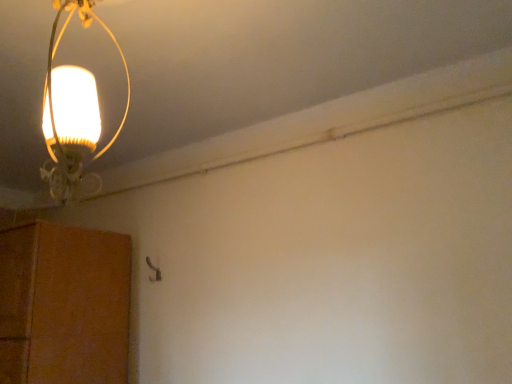
The height and width of the screenshot is (384, 512). I want to click on matte glass lamp at upper left, so click(72, 112).

Image resolution: width=512 pixels, height=384 pixels. Describe the element at coordinates (72, 112) in the screenshot. I see `matte glass lamp at upper left` at that location.

The height and width of the screenshot is (384, 512). What do you see at coordinates (66, 302) in the screenshot?
I see `brown textured cabinet at lower left` at bounding box center [66, 302].

I want to click on brown textured cabinet at lower left, so click(66, 302).

The width and height of the screenshot is (512, 384). What are the coordinates of `matte glass lamp at upper left` in the screenshot? It's located at (72, 112).

Is brown textured cabinet at lower left to the right of matte glass lamp at upper left from the viewer's perspective?

In fact, brown textured cabinet at lower left is to the left of matte glass lamp at upper left.

Is brown textured cabinet at lower left in front of matte glass lamp at upper left?

No, brown textured cabinet at lower left is behind matte glass lamp at upper left.

Which point is more distant from viewer, [4,295] or [84,145]?

The point [4,295] is farther.

From the image's perspective, is brown textured cabinet at lower left located above matte glass lamp at upper left?

Incorrect, from the image's perspective, brown textured cabinet at lower left is lower than matte glass lamp at upper left.

From a real-world perspective, is brown textured cabinet at lower left below matte glass lamp at upper left?

Yes, from a real-world perspective, brown textured cabinet at lower left is below matte glass lamp at upper left.

Does brown textured cabinet at lower left have a lesser width compared to matte glass lamp at upper left?

No.

Considering the relative sizes of brown textured cabinet at lower left and matte glass lamp at upper left in the image provided, is brown textured cabinet at lower left taller than matte glass lamp at upper left?

Yes, brown textured cabinet at lower left is taller than matte glass lamp at upper left.

Consider the image. Can you confirm if brown textured cabinet at lower left is smaller than matte glass lamp at upper left?

Incorrect, brown textured cabinet at lower left is not smaller in size than matte glass lamp at upper left.

Is brown textured cabinet at lower left located outside matte glass lamp at upper left?

Yes, brown textured cabinet at lower left is not within matte glass lamp at upper left.

Is brown textured cabinet at lower left directly adjacent to matte glass lamp at upper left?

No, brown textured cabinet at lower left is not in contact with matte glass lamp at upper left.

Could you tell me if brown textured cabinet at lower left is facing matte glass lamp at upper left?

No, brown textured cabinet at lower left is not turned towards matte glass lamp at upper left.

What's the angular difference between brown textured cabinet at lower left and matte glass lamp at upper left's facing directions?

88 degrees.

Identify the location of lamp above the brown textured cabinet at lower left (from the image's perspective). (72, 112).

Is matte glass lamp at upper left at the right side of brown textured cabinet at lower left?

Yes, matte glass lamp at upper left is to the right of brown textured cabinet at lower left.

Does matte glass lamp at upper left come behind brown textured cabinet at lower left?

No, it is in front of brown textured cabinet at lower left.

Is point (79, 164) closer to camera compared to point (74, 285)?

Yes, it is.

From the image's perspective, which object appears higher, matte glass lamp at upper left or brown textured cabinet at lower left?

matte glass lamp at upper left appears higher in the image.

In the scene shown: From a real-world perspective, is matte glass lamp at upper left physically above brown textured cabinet at lower left?

Yes, from a real-world perspective, matte glass lamp at upper left is on top of brown textured cabinet at lower left.

From the picture: In terms of width, does matte glass lamp at upper left look wider or thinner when compared to brown textured cabinet at lower left?

matte glass lamp at upper left is thinner than brown textured cabinet at lower left.

Which of these two, matte glass lamp at upper left or brown textured cabinet at lower left, stands shorter?

matte glass lamp at upper left is shorter.

Which of these two, matte glass lamp at upper left or brown textured cabinet at lower left, is bigger?

brown textured cabinet at lower left.

Is matte glass lamp at upper left positioned beyond the bounds of brown textured cabinet at lower left?

Absolutely, matte glass lamp at upper left is external to brown textured cabinet at lower left.

Is there a large distance between matte glass lamp at upper left and brown textured cabinet at lower left?

That's not correct — matte glass lamp at upper left is a little close to brown textured cabinet at lower left.

Is matte glass lamp at upper left aimed at brown textured cabinet at lower left?

No.

How many degrees apart are the facing directions of matte glass lamp at upper left and brown textured cabinet at lower left?

The angle between the facing direction of matte glass lamp at upper left and the facing direction of brown textured cabinet at lower left is 88 degrees.

How far apart are matte glass lamp at upper left and brown textured cabinet at lower left?

matte glass lamp at upper left is 33.86 inches from brown textured cabinet at lower left.

Where is `cabinetry that appears on the left of matte glass lamp at upper left`? Image resolution: width=512 pixels, height=384 pixels. cabinetry that appears on the left of matte glass lamp at upper left is located at coordinates (66, 302).

Locate an element on the screen. cabinetry that is under the matte glass lamp at upper left (from a real-world perspective) is located at coordinates (66, 302).

Identify the location of cabinetry that is behind the matte glass lamp at upper left. This screenshot has width=512, height=384. (66, 302).